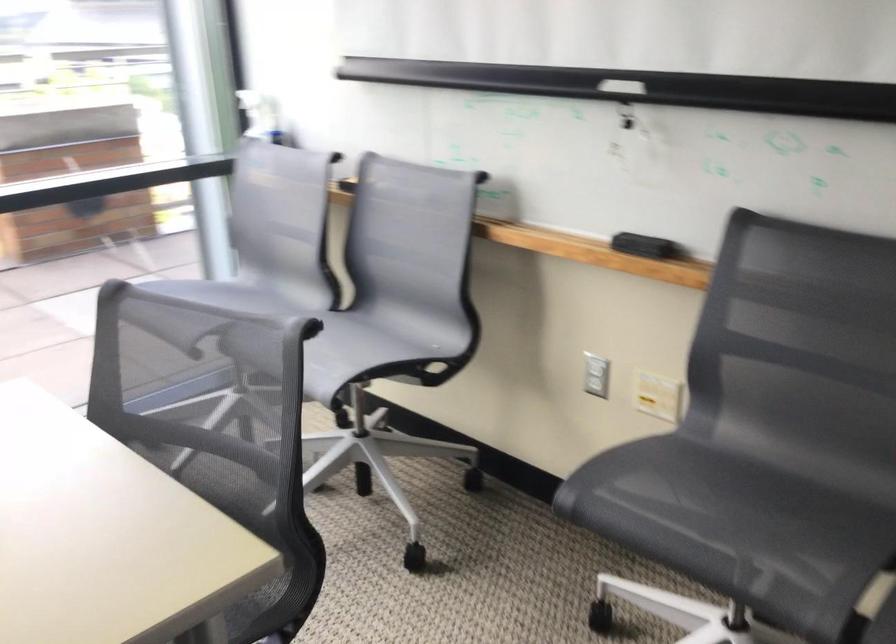
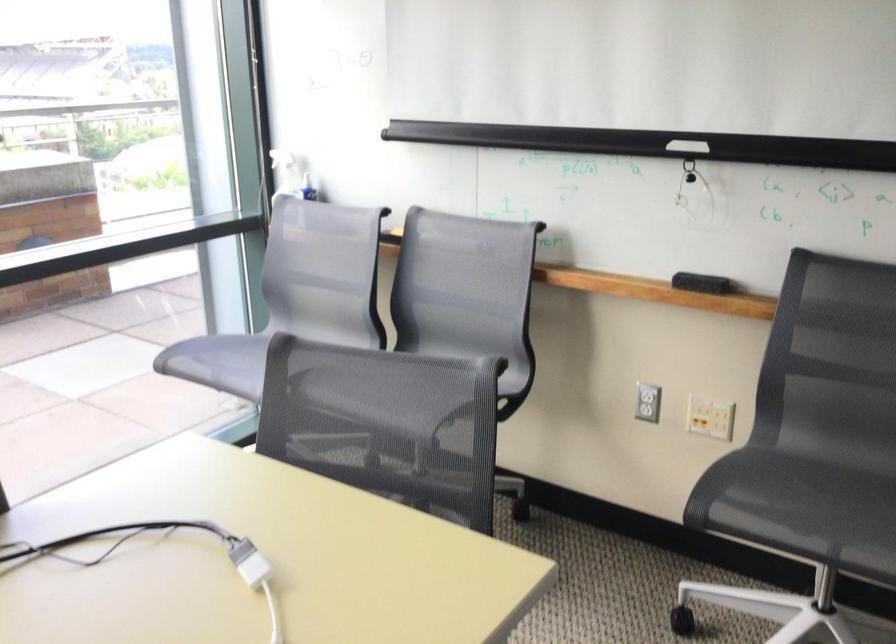
Find the pixel in the second image that matches pixel 682 491 in the first image.

(782, 494)